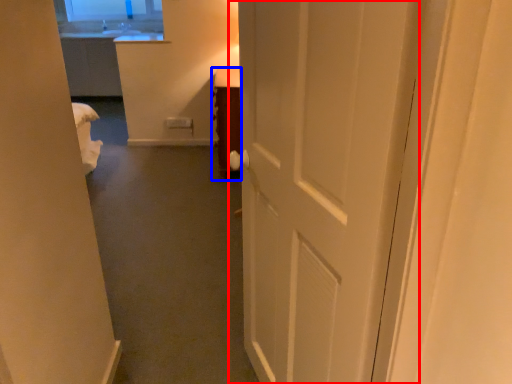
Question: Which object is closer to the camera taking this photo, door (highlighted by a red box) or furniture (highlighted by a blue box)?

Choices:
 (A) door
 (B) furniture

Answer: (A)